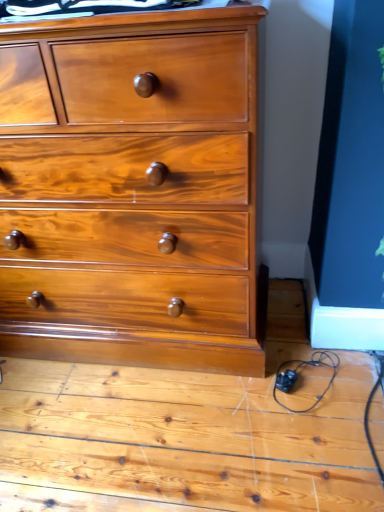
The image size is (384, 512). What do you see at coordinates (298, 375) in the screenshot? I see `black rubber cable at lower right` at bounding box center [298, 375].

From the picture: Measure the distance between point (x=273, y=389) and camera.

Point (x=273, y=389) and camera are 1.26 meters apart.

Image resolution: width=384 pixels, height=512 pixels. Find the location of `black rubber cable at lower right`. black rubber cable at lower right is located at coordinates (298, 375).

At what (x,y) coordinates should I click in order to perform the action: click on black rubber cable at lower right. Please return your answer as a coordinate pair (x, y). Looking at the image, I should click on (298, 375).